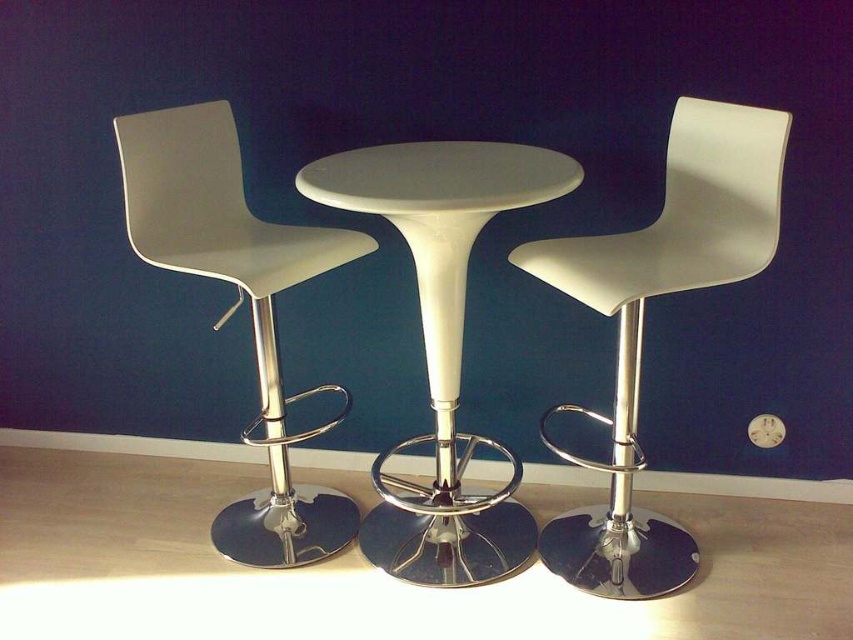
You are a furniture designer who wants to ensure that the white matte chair at center and the white glossy table at center are positioned for optimal comfort and functionality. Based on the given distance between them, is the current spacing between the chair and table appropriate for someone of average height?

The distance between the white matte chair at center and white glossy table at center is 9.87 inches. For optimal comfort and functionality, the standard recommended distance between a chair and a table for someone of average height is typically between 10 to 12 inches. Therefore, the current spacing is slightly below the recommended range and may require adjustment to ensure proper legroom and ease of movement.

You are a furniture designer who needs to determine seating arrangements for a client. The client has a 6.5 feet high ceiling. They want to place the white matte chair at center and white matte bar stool at left in their dining area. Considering the ceiling height, will the tallest object in this setup exceed the ceiling height?

The white matte chair at center is taller than the white matte bar stool at left. However, without specific height measurements for either object, it is impossible to determine if they exceed the 6.5 feet ceiling height. Additional information about their actual heights is required to answer this question accurately.